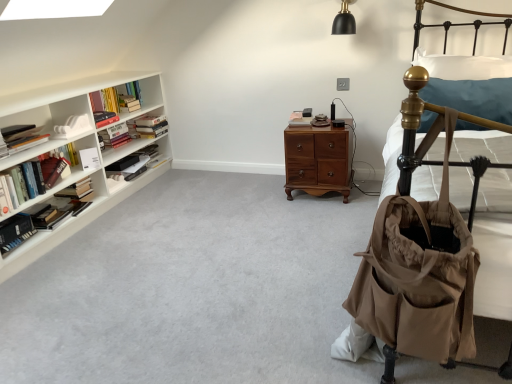
Where is `free space in front of brown wood nightstand at center`? The width and height of the screenshot is (512, 384). free space in front of brown wood nightstand at center is located at coordinates (317, 211).